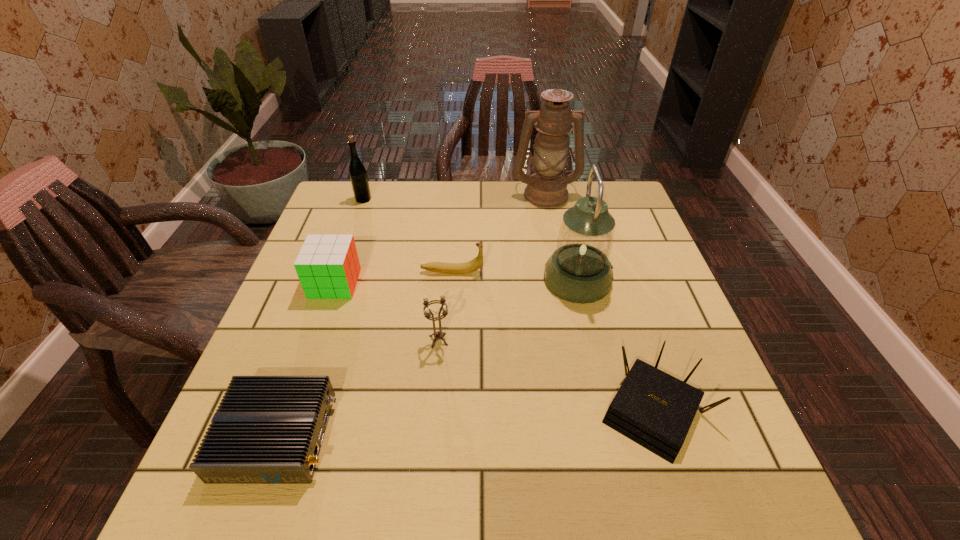
You are a GUI agent. You are given a task and a screenshot of the screen. Output one action in this format:
    pyautogui.click(x=<x>, y=<y>)
    Task: Click on the free space between the cube and the shorter router
    The width and height of the screenshot is (960, 540).
    Given the screenshot: What is the action you would take?
    pyautogui.click(x=306, y=360)

Identify the location of empty location between the banana and the shorter router. This screenshot has width=960, height=540. (365, 354).

You are a GUI agent. You are given a task and a screenshot of the screen. Output one action in this format:
    pyautogui.click(x=<x>, y=<y>)
    Task: Click on the free spot between the sixth shortest object and the lantern
    The image size is (960, 540).
    Given the screenshot: What is the action you would take?
    pyautogui.click(x=470, y=239)

Locate which object is the second closest to the taller router. Please provide its 2D coordinates. Your answer should be formatted as a tuple, i.e. [(x, y)], where the tuple contains the x and y coordinates of a point satisfying the conditions above.

[(437, 335)]

Find the location of `the second closest object to the oil lamp`. the second closest object to the oil lamp is located at coordinates (451, 268).

What are the coordinates of `vacant region that satisfies the following two spatial constraints: 1. at the stem of the taller router; 2. on the right side of the banana` in the screenshot? It's located at (443, 411).

The width and height of the screenshot is (960, 540). What are the coordinates of `vacant space that satisfies the following two spatial constraints: 1. on the front side of the cube; 2. on the back panel of the shorter router` in the screenshot? It's located at (281, 436).

I want to click on free point that satisfies the following two spatial constraints: 1. at the stem of the banana; 2. on the left side of the lantern, so click(x=451, y=279).

The image size is (960, 540). I want to click on free region that satisfies the following two spatial constraints: 1. on the front side of the third nearest object; 2. on the left side of the beer bottle, so click(314, 340).